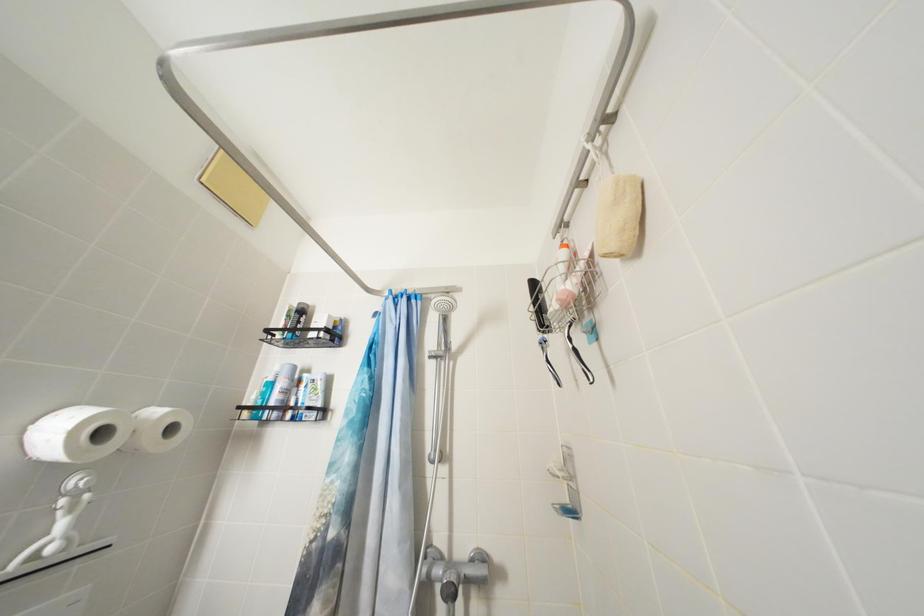
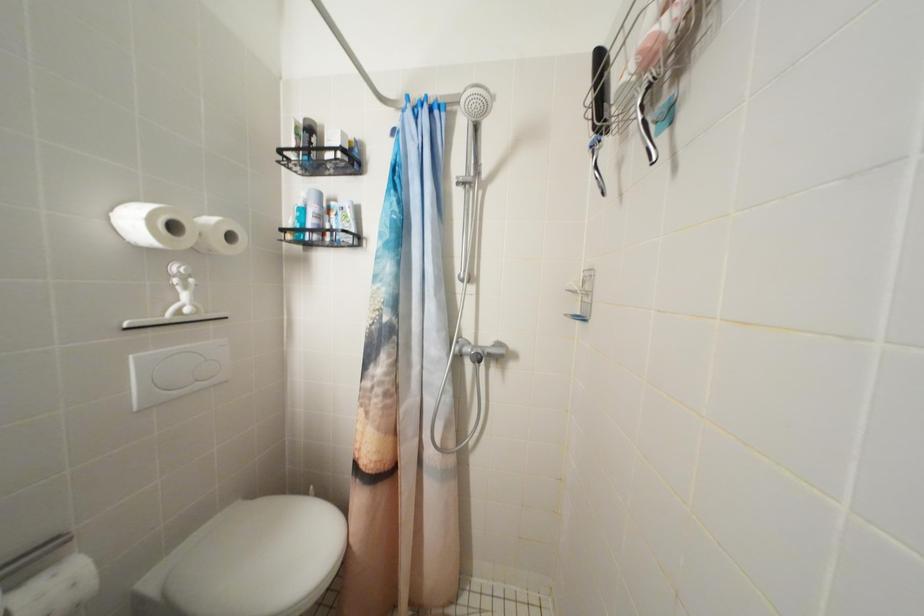
Question: The first image is from the beginning of the video and the second image is from the end. How did the camera likely rotate when shooting the video?

Choices:
 (A) Left
 (B) Right
 (C) Up
 (D) Down

Answer: (D)